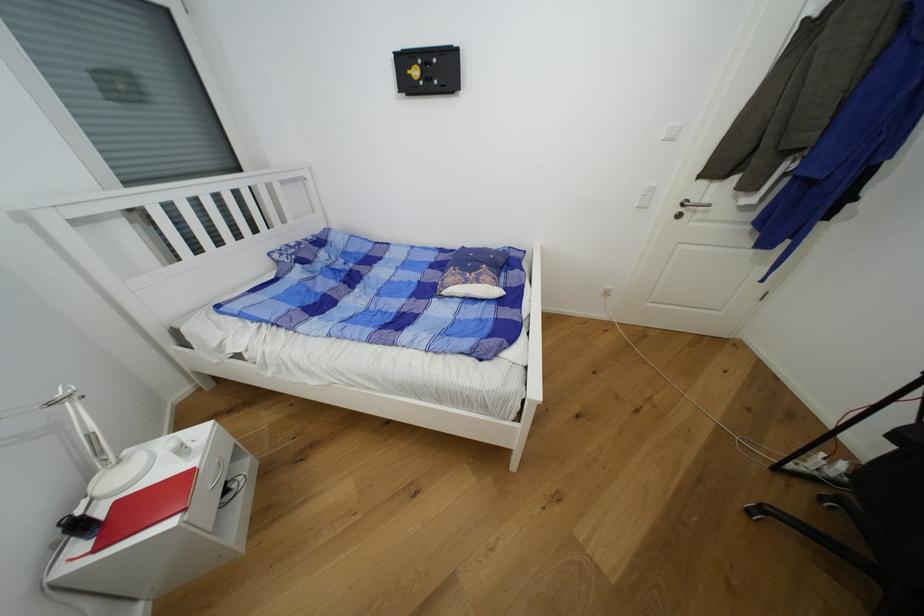
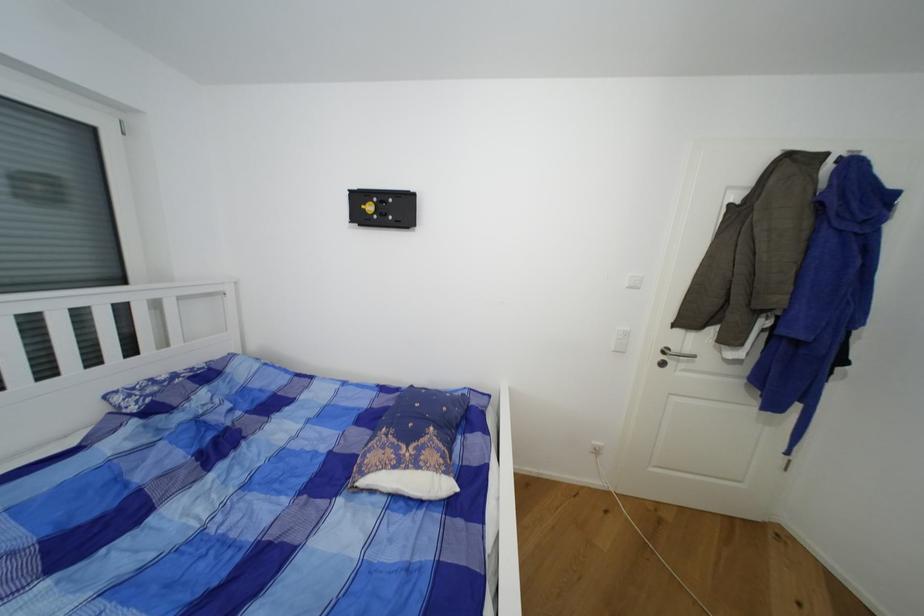
Find the pixel in the second image that matches the point at 711,203 in the first image.

(691, 352)